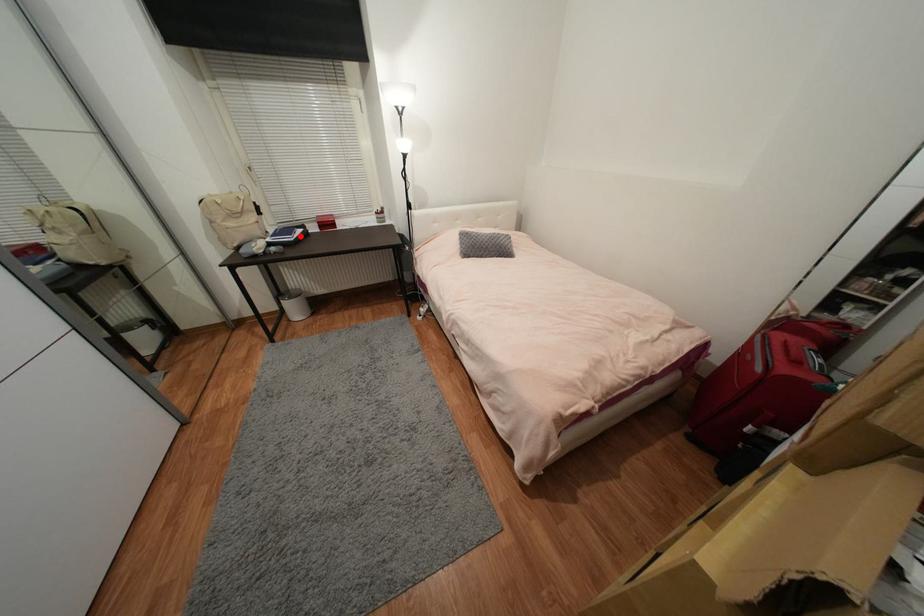
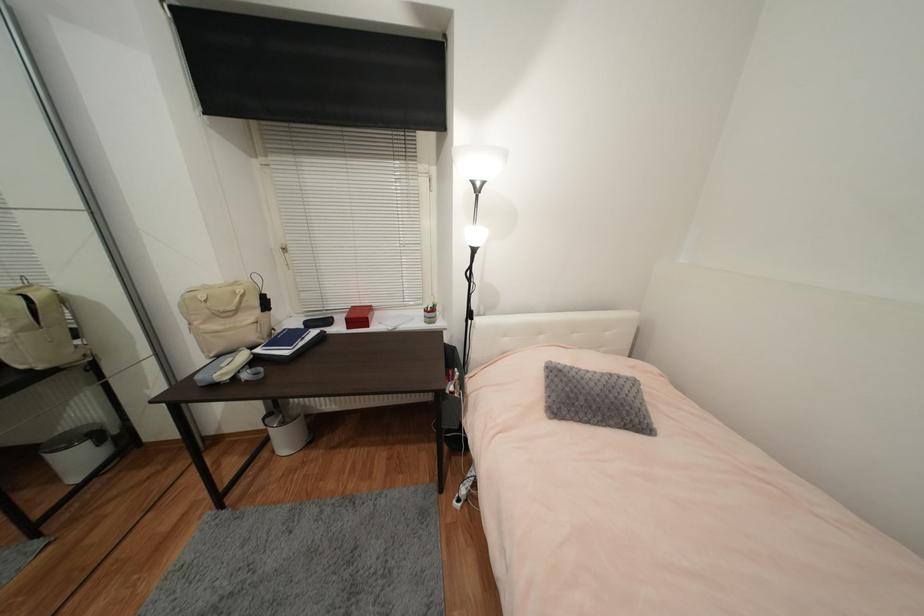
Where in the second image is the point corresponding to the highlighted location from the first image?

(306, 344)